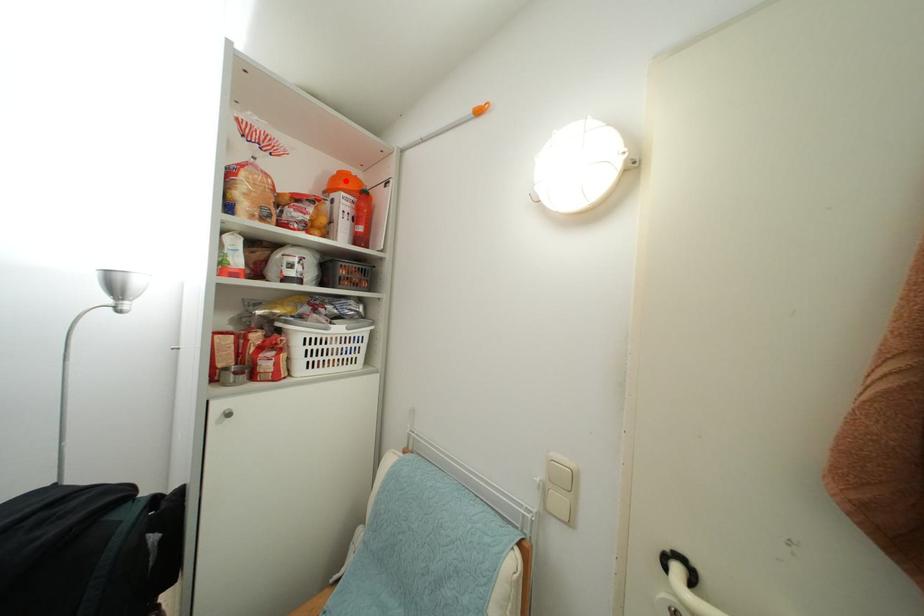
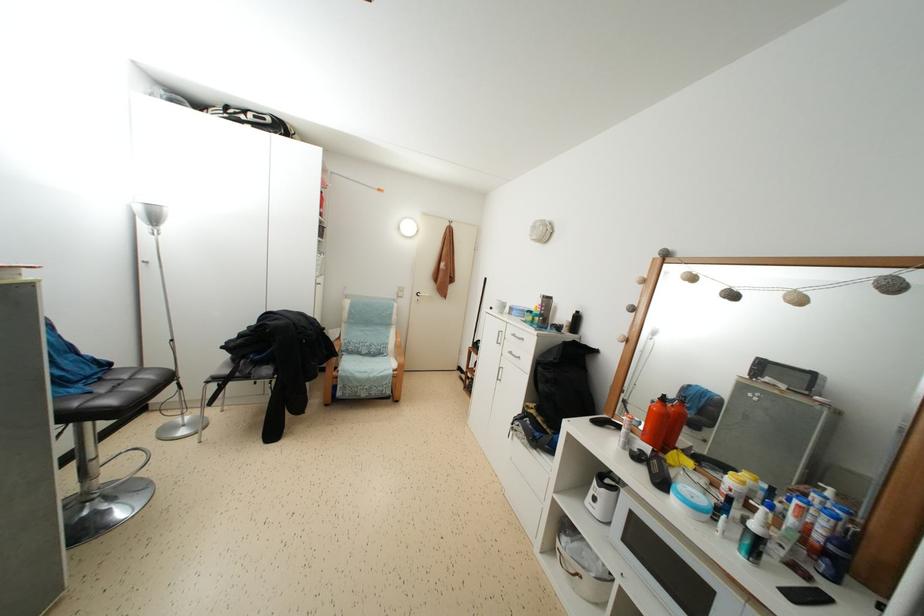
Question: I am providing you with two images of the same scene from different viewpoints. A red point is marked on the first image. At the location where the point appears in image 1, is it still visible in image 2?

Choices:
 (A) Yes
 (B) No

Answer: (B)